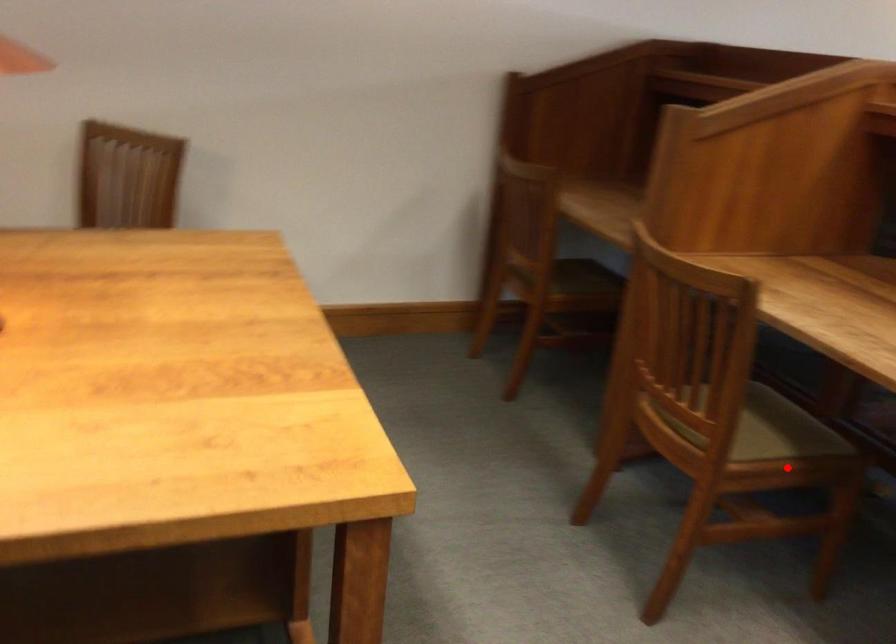
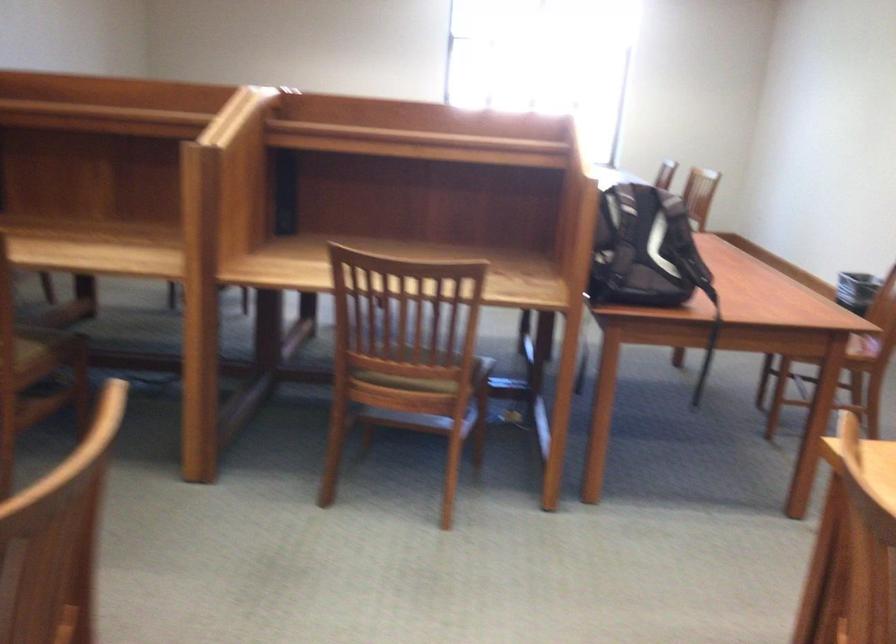
In the second image, find the point that corresponds to the highlighted location in the first image.

(46, 348)